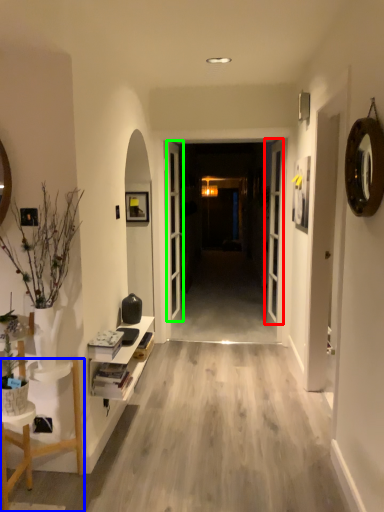
Question: Estimate the real-world distances between objects in this image. Which object is closer to door (highlighted by a red box), furniture (highlighted by a blue box) or door (highlighted by a green box)?

Choices:
 (A) furniture
 (B) door

Answer: (B)